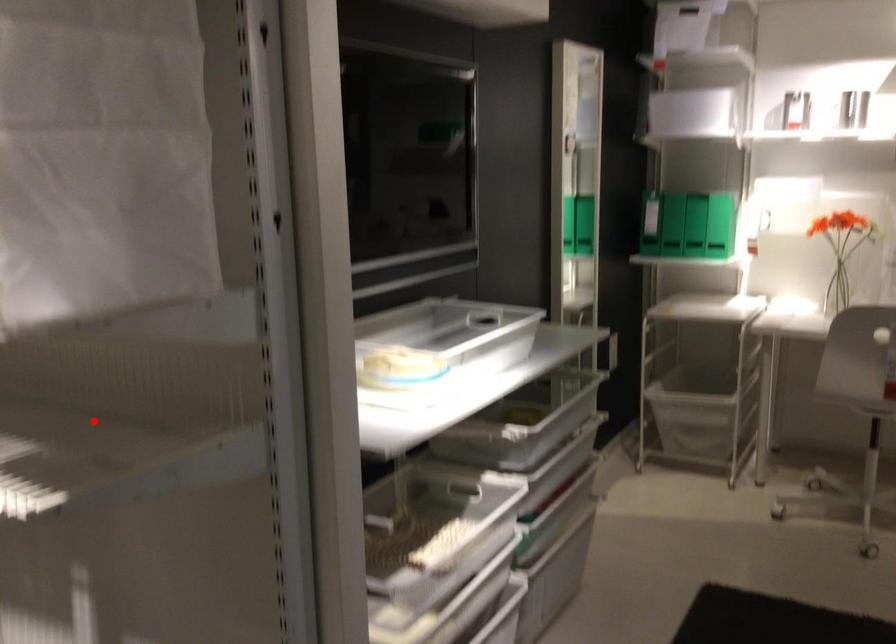
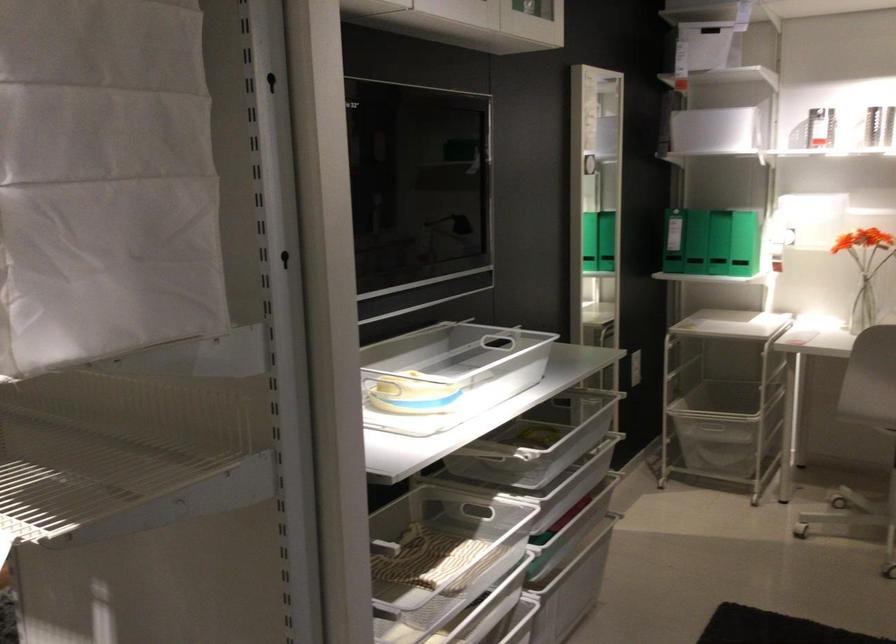
Where in the second image is the point corresponding to the highlighted location from the first image?

(108, 444)